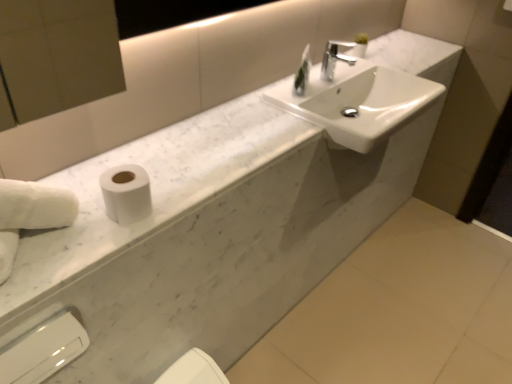
Question: Can we say white marble counter top at center lies outside clear glass soap dispenser at upper center?

Choices:
 (A) yes
 (B) no

Answer: (A)

Question: Is the position of white marble counter top at center more distant than that of clear glass soap dispenser at upper center?

Choices:
 (A) no
 (B) yes

Answer: (A)

Question: Could you tell me if white marble counter top at center is turned towards clear glass soap dispenser at upper center?

Choices:
 (A) no
 (B) yes

Answer: (A)

Question: Is white marble counter top at center bigger than clear glass soap dispenser at upper center?

Choices:
 (A) yes
 (B) no

Answer: (A)

Question: Considering the relative sizes of white marble counter top at center and clear glass soap dispenser at upper center in the image provided, is white marble counter top at center taller than clear glass soap dispenser at upper center?

Choices:
 (A) yes
 (B) no

Answer: (B)

Question: Would you consider white marble counter top at center to be distant from clear glass soap dispenser at upper center?

Choices:
 (A) no
 (B) yes

Answer: (A)

Question: Is white fluffy hand towel at left surrounded by chrome metallic faucet at upper center?

Choices:
 (A) no
 (B) yes

Answer: (A)

Question: Could you tell me if chrome metallic faucet at upper center is turned towards white fluffy hand towel at left?

Choices:
 (A) no
 (B) yes

Answer: (A)

Question: From a real-world perspective, is chrome metallic faucet at upper center under white fluffy hand towel at left?

Choices:
 (A) no
 (B) yes

Answer: (A)

Question: Is chrome metallic faucet at upper center looking in the opposite direction of white fluffy hand towel at left?

Choices:
 (A) yes
 (B) no

Answer: (B)

Question: From the image's perspective, is chrome metallic faucet at upper center on top of white fluffy hand towel at left?

Choices:
 (A) yes
 (B) no

Answer: (A)

Question: Can you confirm if chrome metallic faucet at upper center is smaller than white fluffy hand towel at left?

Choices:
 (A) yes
 (B) no

Answer: (A)

Question: Does clear glass soap dispenser at upper center have a larger size compared to white fluffy hand towel at left?

Choices:
 (A) yes
 (B) no

Answer: (B)